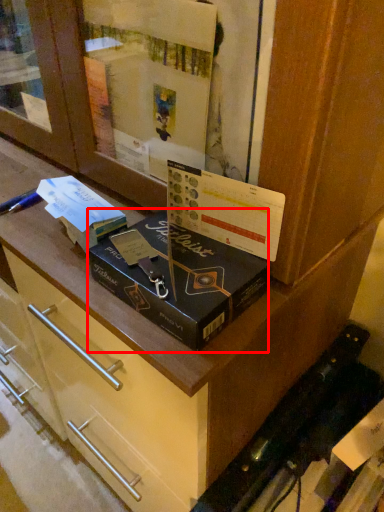
Question: Observing the image, what is the correct spatial positioning of box (annotated by the red box) in reference to book?

Choices:
 (A) right
 (B) left

Answer: (A)